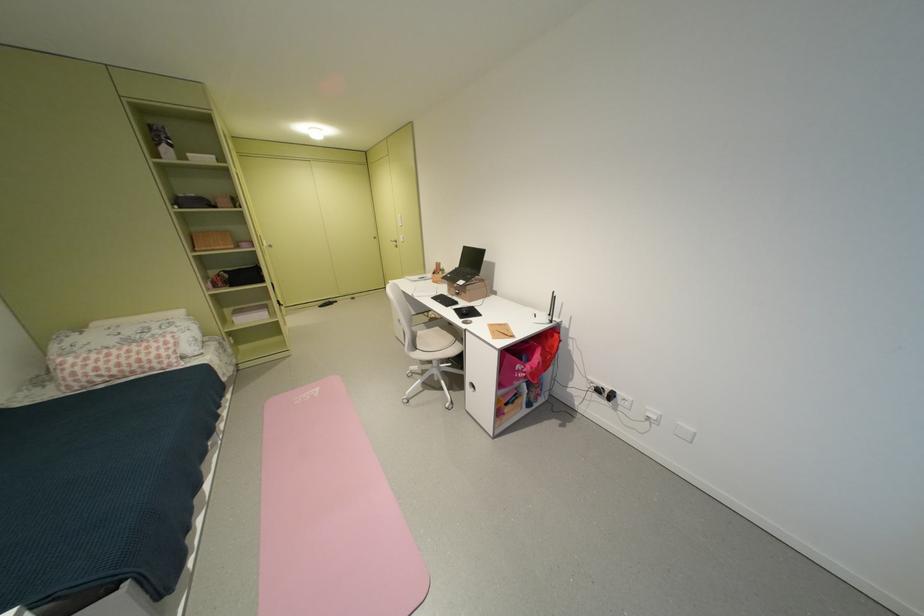
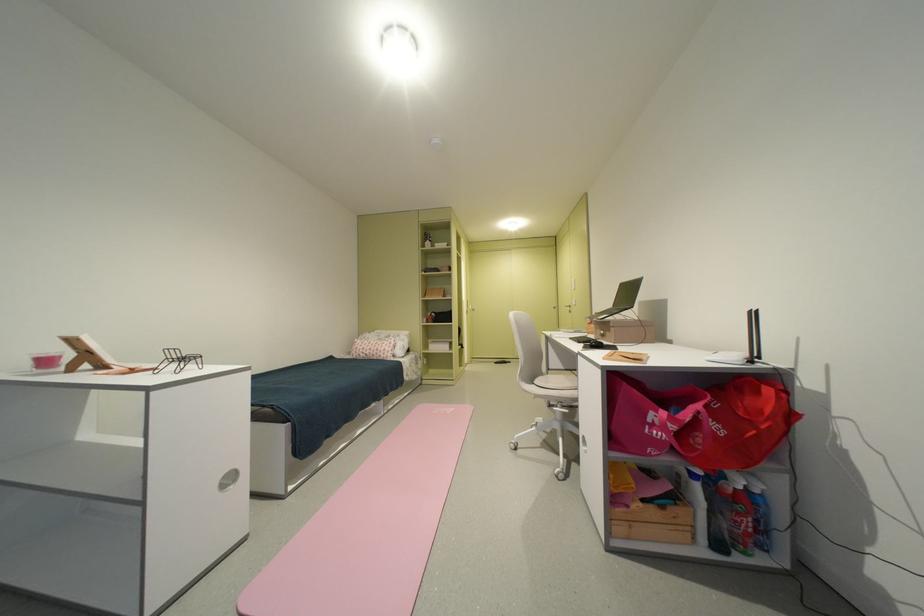
Locate, in the second image, the point that corresponds to point 305,403 in the first image.

(444, 413)